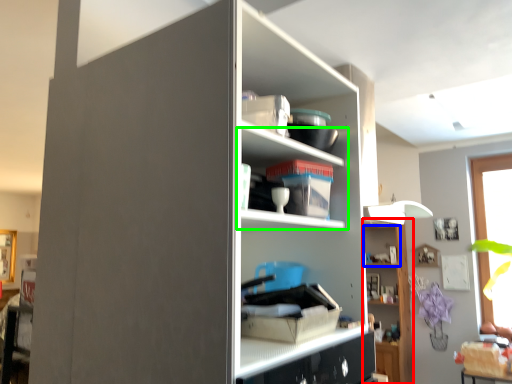
Question: Based on their relative distances, which object is nearer to shelf (highlighted by a red box)? Choose from cabinet (highlighted by a blue box) and shelf (highlighted by a green box).

Choices:
 (A) cabinet
 (B) shelf

Answer: (A)